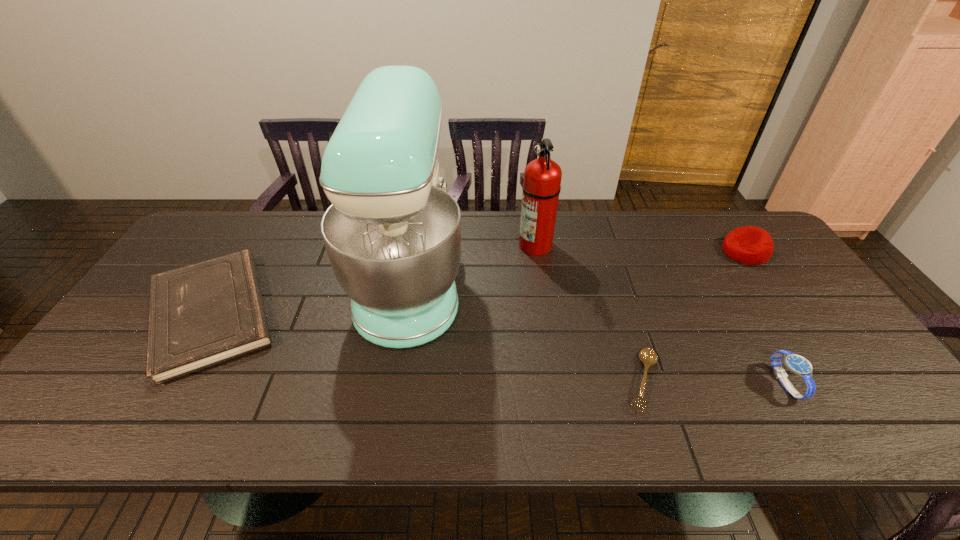
The width and height of the screenshot is (960, 540). What are the coordinates of `free spot located 0.330m at the base of the mixer` in the screenshot? It's located at (578, 280).

Locate an element on the screen. free point located at the nozzle of the third object from left to right is located at coordinates (474, 245).

Where is `vacant space located at the nozzle of the third object from left to right`? vacant space located at the nozzle of the third object from left to right is located at coordinates (459, 245).

Identify the location of vacant space located 0.400m at the nozzle of the third object from left to right. This screenshot has width=960, height=540. (393, 245).

The width and height of the screenshot is (960, 540). What are the coordinates of `free space located on the seat area of the beanbag` in the screenshot? It's located at (665, 252).

The height and width of the screenshot is (540, 960). Identify the location of blank space located 0.130m on the seat area of the beanbag. pos(682,252).

Locate an element on the screen. This screenshot has width=960, height=540. vacant area situated on the seat area of the beanbag is located at coordinates (704, 252).

Locate an element on the screen. vacant area situated 0.180m on the right of the second object from right to left is located at coordinates (875, 383).

Where is `vacant area situated on the right of the paperback book`? This screenshot has width=960, height=540. vacant area situated on the right of the paperback book is located at coordinates (387, 313).

Find the location of a particular element. The height and width of the screenshot is (540, 960). free space located on the back of the fourth object from left to right is located at coordinates (601, 249).